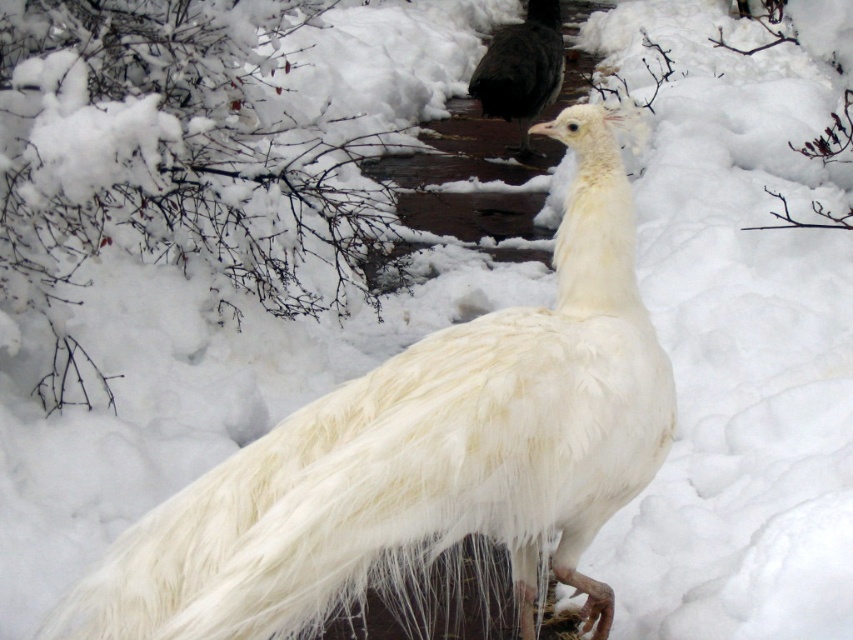
You are a photographer trying to capture both the white feathered peacock at center and the black glossy bird at center in a single shot. Based on their positions, which one should you adjust your camera focus to first to ensure both are in frame?

The white feathered peacock at center is to the left of the black glossy bird at center. To capture both in a single shot, adjust your camera focus to the white feathered peacock at center first since it is positioned further left, ensuring the entire span from left to right is within the frame.

You are a photographer trying to capture both the white feathered peacock at center and the black glossy bird at center in a single shot. Based on their positions, which one will appear closer to the camera in the photo?

The white feathered peacock at center will appear closer to the camera because it is positioned in front of the black glossy bird at center in the scene.

You are a wildlife photographer trying to capture both the white feathered peacock at center and the black glossy bird at center in a single frame. Based on their positions and sizes, which bird would require you to zoom out more to include its entire body in the photo?

The white feathered peacock at center might be wider than black glossy bird at center, so you would need to zoom out more to capture the entire body of the white feathered peacock at center.